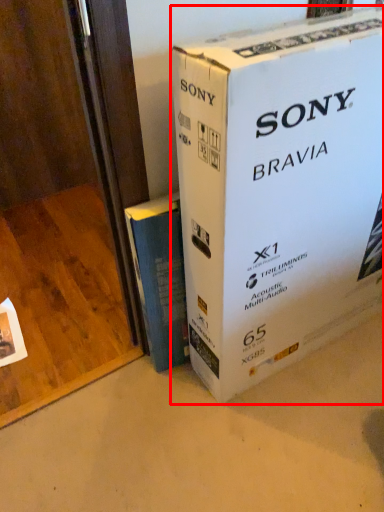
Question: Observing the image, what is the correct spatial positioning of box (annotated by the red box) in reference to book?

Choices:
 (A) left
 (B) right

Answer: (B)